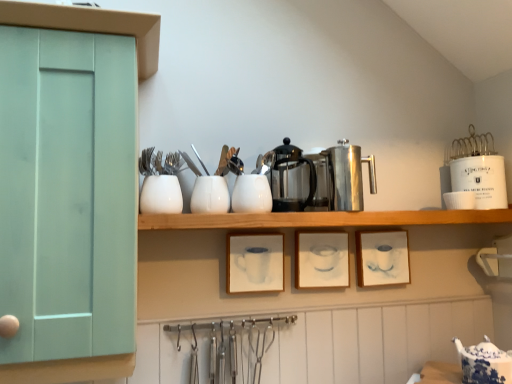
The height and width of the screenshot is (384, 512). I want to click on white glossy teapot at center, the fifth tableware in the left-to-right sequence, so click(251, 194).

What do you see at coordinates (210, 195) in the screenshot? This screenshot has width=512, height=384. I see `white glossy vase at center, which is counted as the 4th tableware, starting from the left` at bounding box center [210, 195].

What do you see at coordinates (200, 160) in the screenshot?
I see `satin silver spoon at upper center, positioned as the 7th tableware in bottom-to-top order` at bounding box center [200, 160].

Where is `white glossy vase at upper center, placed as the fourth tableware when sorted from top to bottom`? white glossy vase at upper center, placed as the fourth tableware when sorted from top to bottom is located at coordinates (161, 195).

In order to click on mint green wood cabinet at left in this screenshot , I will do `click(92, 26)`.

This screenshot has width=512, height=384. Identify the location of white glossy teapot at center, the third tableware from the right. (251, 194).

Based on the photo, is white glossy vase at upper center, which is counted as the 1th tableware, starting from the left, looking in the opposite direction of satin silver spoon at upper center, positioned as the 7th tableware in bottom-to-top order?

No, white glossy vase at upper center, which is counted as the 1th tableware, starting from the left, is not facing the opposite direction of satin silver spoon at upper center, positioned as the 7th tableware in bottom-to-top order.

Considering the positions of objects white glossy vase at upper center, which is counted as the 1th tableware, starting from the left, and satin silver spoon at upper center, positioned as the 7th tableware in bottom-to-top order, in the image provided, who is in front, white glossy vase at upper center, which is counted as the 1th tableware, starting from the left, or satin silver spoon at upper center, positioned as the 7th tableware in bottom-to-top order,?

white glossy vase at upper center, which is counted as the 1th tableware, starting from the left.

Is white glossy vase at upper center, the seventh tableware viewed from the right, wider or thinner than satin silver spoon at upper center, acting as the 3th tableware starting from the left?

white glossy vase at upper center, the seventh tableware viewed from the right, is wider than satin silver spoon at upper center, acting as the 3th tableware starting from the left.

From their relative heights in the image, would you say white matte picture frame at center, the third picture frame from the right, is taller or shorter than mint green wood cabinet at left?

white matte picture frame at center, the third picture frame from the right, is shorter than mint green wood cabinet at left.

Looking at this image, from a real-world perspective, between white matte picture frame at center, the third picture frame from the right, and mint green wood cabinet at left, who is vertically lower?

white matte picture frame at center, the third picture frame from the right, is physically lower.

Is white matte picture frame at center, marked as the 1th picture frame in a left-to-right arrangement, turned away from mint green wood cabinet at left?

No.

From the image's perspective, is white matte picture frame at center, marked as the 1th picture frame in a left-to-right arrangement, positioned above or below mint green wood cabinet at left?

white matte picture frame at center, marked as the 1th picture frame in a left-to-right arrangement, is below mint green wood cabinet at left.

Looking at this image, could you tell me if polished stainless steel coffee press at center, the second appliance positioned from the right, is facing satin silver spoon at upper center, arranged as the 1th tableware when viewed from the top?

No, polished stainless steel coffee press at center, the second appliance positioned from the right, is not facing towards satin silver spoon at upper center, arranged as the 1th tableware when viewed from the top.

From the image's perspective, does polished stainless steel coffee press at center, the second appliance positioned from the right, appear lower than satin silver spoon at upper center, arranged as the 1th tableware when viewed from the top?

Yes, from the image's perspective, polished stainless steel coffee press at center, the second appliance positioned from the right, is beneath satin silver spoon at upper center, arranged as the 1th tableware when viewed from the top.

Does polished stainless steel coffee press at center, which appears as the 3th appliance when viewed from the left, lie in front of satin silver spoon at upper center, acting as the 3th tableware starting from the left?

Yes, polished stainless steel coffee press at center, which appears as the 3th appliance when viewed from the left, is in front of satin silver spoon at upper center, acting as the 3th tableware starting from the left.

Considering the sizes of polished stainless steel coffee press at center, the second appliance positioned from the right, and satin silver spoon at upper center, arranged as the 1th tableware when viewed from the top, in the image, is polished stainless steel coffee press at center, the second appliance positioned from the right, taller or shorter than satin silver spoon at upper center, arranged as the 1th tableware when viewed from the top,?

Clearly, polished stainless steel coffee press at center, the second appliance positioned from the right, is taller compared to satin silver spoon at upper center, arranged as the 1th tableware when viewed from the top.

From the image's perspective, relative to white matte picture frame at center, marked as the 1th picture frame in a left-to-right arrangement, is white glossy cup at upper right, the 2th tableware viewed from the right, above or below?

From the image's perspective, white glossy cup at upper right, the 2th tableware viewed from the right, appears above white matte picture frame at center, marked as the 1th picture frame in a left-to-right arrangement.

Between white glossy cup at upper right, placed as the sixth tableware when sorted from left to right, and white matte picture frame at center, the third picture frame from the right, which one appears on the right side from the viewer's perspective?

From the viewer's perspective, white glossy cup at upper right, placed as the sixth tableware when sorted from left to right, appears more on the right side.

Considering the sizes of white glossy cup at upper right, the 2th tableware viewed from the right, and white matte picture frame at center, marked as the 1th picture frame in a left-to-right arrangement, in the image, is white glossy cup at upper right, the 2th tableware viewed from the right, wider or thinner than white matte picture frame at center, marked as the 1th picture frame in a left-to-right arrangement,?

In the image, white glossy cup at upper right, the 2th tableware viewed from the right, appears to be wider than white matte picture frame at center, marked as the 1th picture frame in a left-to-right arrangement.

Is point (455, 193) closer to viewer compared to point (281, 235)?

No, it is not.

From the image's perspective, which is below, mint green wood cabinet at left or satin silver spoon at upper center, acting as the 3th tableware starting from the left?

mint green wood cabinet at left appears lower in the image.

Is mint green wood cabinet at left not close to satin silver spoon at upper center, acting as the 3th tableware starting from the left?

No, mint green wood cabinet at left is not far away from satin silver spoon at upper center, acting as the 3th tableware starting from the left.

Is point (27, 366) closer or farther from the camera than point (206, 170)?

Point (27, 366).

Is polished stainless steel coffee pot at center, placed as the 1th appliance when sorted from left to right, to the right of white glossy vase at center, the fifth tableware viewed from the top, from the viewer's perspective?

Indeed, polished stainless steel coffee pot at center, placed as the 1th appliance when sorted from left to right, is positioned on the right side of white glossy vase at center, the fifth tableware viewed from the top.

Is polished stainless steel coffee pot at center, placed as the 1th appliance when sorted from left to right, placed right next to white glossy vase at center, which is counted as the 4th tableware, starting from the left?

polished stainless steel coffee pot at center, placed as the 1th appliance when sorted from left to right, and white glossy vase at center, which is counted as the 4th tableware, starting from the left, are not in contact.

Considering the sizes of objects polished stainless steel coffee pot at center, the fourth appliance from the right, and white glossy vase at center, the fifth tableware viewed from the top, in the image provided, who is taller, polished stainless steel coffee pot at center, the fourth appliance from the right, or white glossy vase at center, the fifth tableware viewed from the top,?

With more height is polished stainless steel coffee pot at center, the fourth appliance from the right.

Considering the positions of objects polished stainless steel coffee pot at center, the fourth appliance from the right, and white glossy vase at center, marked as the third tableware in a bottom-to-top arrangement, in the image provided, who is behind, polished stainless steel coffee pot at center, the fourth appliance from the right, or white glossy vase at center, marked as the third tableware in a bottom-to-top arrangement,?

white glossy vase at center, marked as the third tableware in a bottom-to-top arrangement, is further from the camera.

Is white matte picture frame at center, marked as the 1th picture frame in a left-to-right arrangement, at the right side of white glossy fork at upper center, the 6th tableware ordered from the bottom?

Indeed, white matte picture frame at center, marked as the 1th picture frame in a left-to-right arrangement, is positioned on the right side of white glossy fork at upper center, the 6th tableware ordered from the bottom.

Is white matte picture frame at center, marked as the 1th picture frame in a left-to-right arrangement, bigger than white glossy fork at upper center, positioned as the second tableware in left-to-right order?

Yes.

From a real-world perspective, is white matte picture frame at center, the third picture frame from the right, physically above white glossy fork at upper center, the second tableware positioned from the top?

No, from a real-world perspective, white matte picture frame at center, the third picture frame from the right, is not on top of white glossy fork at upper center, the second tableware positioned from the top.

In the scene shown: From the image's perspective, between white matte picture frame at center, the third picture frame from the right, and white glossy fork at upper center, the second tableware positioned from the top, who is located below?

white matte picture frame at center, the third picture frame from the right.

You are a GUI agent. You are given a task and a screenshot of the screen. Output one action in this format:
    pyautogui.click(x=<x>, y=<y>)
    Task: Click on the 2nd tableware counting from the left of the satin silver spoon at upper center, the fifth tableware positioned from the right
    
    Given the screenshot: What is the action you would take?
    pyautogui.click(x=161, y=195)

Identify the location of the 1st picture frame behind the mint green wood cabinet at left, starting your count from the anchor. pyautogui.click(x=255, y=262).

When comparing their distances from white glossy teapot at center, which is counted as the third tableware, starting from the top, does matte white picture frame at center, the third picture frame in the left-to-right sequence, or satin silver carafe at center, acting as the third appliance starting from the right, seem further?

Based on the image, matte white picture frame at center, the third picture frame in the left-to-right sequence, appears to be further to white glossy teapot at center, which is counted as the third tableware, starting from the top.

Estimate the real-world distances between objects in this image. Which object is closer to mint green wood cabinet at left, polished stainless steel coffee pot at center, placed as the 1th appliance when sorted from left to right, or matte white picture frame at center, the third picture frame in the left-to-right sequence?

Among the two, polished stainless steel coffee pot at center, placed as the 1th appliance when sorted from left to right, is located nearer to mint green wood cabinet at left.

Looking at the image, which one is located closer to matte white picture frame at center, the third picture frame in the left-to-right sequence, white glossy cup at upper right, the second tableware ordered from the bottom, or satin silver spoon at upper center, positioned as the 7th tableware in bottom-to-top order?

white glossy cup at upper right, the second tableware ordered from the bottom, is closer to matte white picture frame at center, the third picture frame in the left-to-right sequence.

Based on their spatial positions, is white glossy vase at center, marked as the third tableware in a bottom-to-top arrangement, or white glossy teapot at center, the fifth tableware in the left-to-right sequence, closer to satin silver carafe at center, placed as the second appliance when sorted from left to right?

white glossy teapot at center, the fifth tableware in the left-to-right sequence.

When comparing their distances from white glossy teapot at center, which is counted as the third tableware, starting from the top, does white matte picture frame at center, marked as the 1th picture frame in a left-to-right arrangement, or polished stainless steel coffee press at center, the second appliance positioned from the right, seem further?

Among the two, polished stainless steel coffee press at center, the second appliance positioned from the right, is located further to white glossy teapot at center, which is counted as the third tableware, starting from the top.

From the image, which object appears to be farther from white glossy fork at upper center, positioned as the second tableware in left-to-right order, mint green wood cabinet at left or white glossy vase at upper center, which is counted as the 1th tableware, starting from the left?

mint green wood cabinet at left is further to white glossy fork at upper center, positioned as the second tableware in left-to-right order.

From the image, which object appears to be farther from wooden shelf at center, satin silver spoon at upper center, the fifth tableware positioned from the right, or polished stainless steel coffee pot at center, the fourth appliance from the right?

The object further to wooden shelf at center is satin silver spoon at upper center, the fifth tableware positioned from the right.

Based on their spatial positions, is white glossy cup at upper right, the 2th tableware viewed from the right, or white glossy vase at upper center, the fourth tableware ordered from the bottom, further from satin silver spoon at upper center, arranged as the 1th tableware when viewed from the top?

Among the two, white glossy cup at upper right, the 2th tableware viewed from the right, is located further to satin silver spoon at upper center, arranged as the 1th tableware when viewed from the top.

Identify the location of tableware between white glossy vase at center, which ranks as the fourth tableware in right-to-left order, and matte white picture frame at center, the third picture frame in the left-to-right sequence, in the horizontal direction. The image size is (512, 384). (251, 194).

This screenshot has width=512, height=384. In order to click on tableware between white glossy vase at center, which ranks as the fourth tableware in right-to-left order, and polished stainless steel coffee pot at center, the fourth appliance from the right in this screenshot , I will do `click(251, 194)`.

Locate an element on the screen. The height and width of the screenshot is (384, 512). picture frame located between polished stainless steel coffee press at center, which appears as the 3th appliance when viewed from the left, and white ceramic container at upper right, acting as the first appliance starting from the right, in the left-right direction is located at coordinates (382, 258).

Locate an element on the screen. Image resolution: width=512 pixels, height=384 pixels. shelf situated between polished stainless steel coffee pot at center, the fourth appliance from the right, and white ceramic container at upper right, acting as the first appliance starting from the right, from left to right is located at coordinates (321, 219).